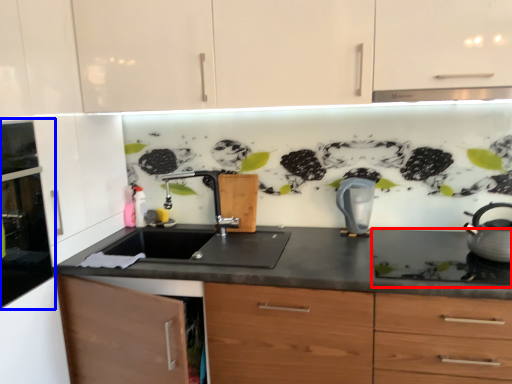
Question: Which object is further to the camera taking this photo, gas stove (highlighted by a red box) or home appliance (highlighted by a blue box)?

Choices:
 (A) gas stove
 (B) home appliance

Answer: (A)